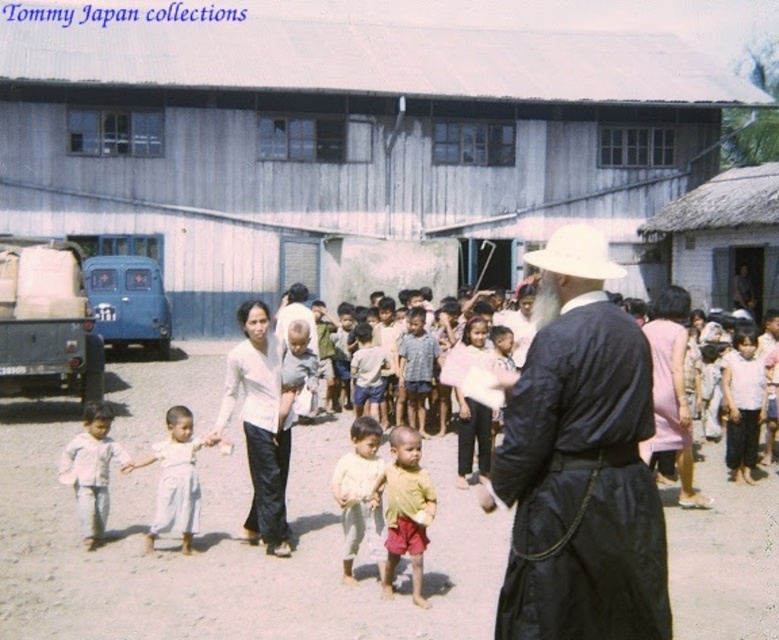
Can you confirm if thatched roof hut at center is positioned to the right of light pink fabric pants at lower left?

Yes, thatched roof hut at center is to the right of light pink fabric pants at lower left.

Is thatched roof hut at center bigger than light pink fabric pants at lower left?

Yes.

Who is more forward, (374,220) or (185,458)?

Positioned in front is point (185,458).

At what (x,y) coordinates should I click in order to perform the action: click on thatched roof hut at center. Please return your answer as a coordinate pair (x, y). This screenshot has width=779, height=640. Looking at the image, I should click on (342, 138).

How much distance is there between thatched roof hut at center and light brown cotton pants at center?

A distance of 110.61 feet exists between thatched roof hut at center and light brown cotton pants at center.

Between point (442, 278) and point (360, 426), which one is positioned in front?

Positioned in front is point (360, 426).

Identify the location of thatched roof hut at center. (342, 138).

Which is below, brown dirt field at center or light pink fabric pants at lower left?

brown dirt field at center

Where is `brown dirt field at center`? The width and height of the screenshot is (779, 640). brown dirt field at center is located at coordinates (224, 552).